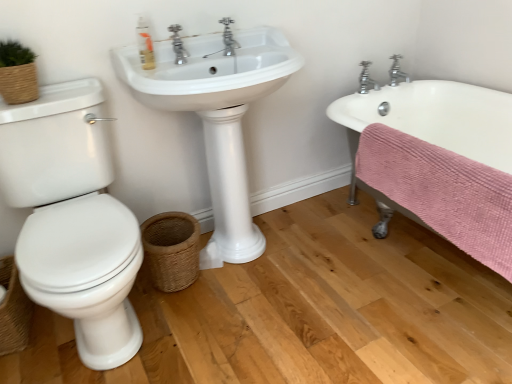
What do you see at coordinates (227, 39) in the screenshot? I see `chrome metallic faucet at upper center, acting as the first tap starting from the left` at bounding box center [227, 39].

What is the approximate width of woven brown basket at lower left, which is the 1th basket in left-to-right order?

13.03 inches.

At what (x,y) coordinates should I click in order to perform the action: click on silver metallic faucet at upper right, which is counted as the second tap, starting from the front. Please return your answer as a coordinate pair (x, y). This screenshot has height=384, width=512. Looking at the image, I should click on click(366, 79).

The image size is (512, 384). What do you see at coordinates (397, 71) in the screenshot? I see `chrome metallic faucet at upper right, which is counted as the 3th tap, starting from the left` at bounding box center [397, 71].

Image resolution: width=512 pixels, height=384 pixels. What do you see at coordinates (145, 45) in the screenshot?
I see `translucent plastic soap dispenser at upper center` at bounding box center [145, 45].

Locate an element on the screen. woven brown basket at lower center, acting as the 1th basket starting from the right is located at coordinates (172, 250).

Is silver metallic faucet at upper right, which ranks as the 2th tap in back-to-front order, facing away from translucent plastic soap dispenser at upper center?

That's not correct — silver metallic faucet at upper right, which ranks as the 2th tap in back-to-front order, is not looking away from translucent plastic soap dispenser at upper center.

From the picture: Is silver metallic faucet at upper right, which appears as the 2th tap when viewed from the right, to the left or to the right of translucent plastic soap dispenser at upper center in the image?

silver metallic faucet at upper right, which appears as the 2th tap when viewed from the right, is to the right of translucent plastic soap dispenser at upper center.

Would you say silver metallic faucet at upper right, which ranks as the 2th tap in back-to-front order, contains translucent plastic soap dispenser at upper center?

Actually, translucent plastic soap dispenser at upper center is outside silver metallic faucet at upper right, which ranks as the 2th tap in back-to-front order.

Looking at the image, does silver metallic faucet at upper right, which is counted as the second tap, starting from the front, seem bigger or smaller compared to translucent plastic soap dispenser at upper center?

Considering their sizes, silver metallic faucet at upper right, which is counted as the second tap, starting from the front, takes up more space than translucent plastic soap dispenser at upper center.

Can you confirm if silver metallic faucet at upper right, which ranks as the 2th tap in back-to-front order, is shorter than white glossy sink at center?

Yes.

Would you say silver metallic faucet at upper right, which appears as the 2th tap when viewed from the right, is outside white glossy sink at center?

Absolutely, silver metallic faucet at upper right, which appears as the 2th tap when viewed from the right, is external to white glossy sink at center.

From a real-world perspective, between silver metallic faucet at upper right, which ranks as the 2th tap in back-to-front order, and white glossy sink at center, who is vertically higher?

In real-world perspective, silver metallic faucet at upper right, which ranks as the 2th tap in back-to-front order, is above.

Does chrome metallic faucet at upper right, arranged as the first tap when viewed from the right, have a lesser height compared to silver metallic faucet at upper right, arranged as the second tap when viewed from the left?

In fact, chrome metallic faucet at upper right, arranged as the first tap when viewed from the right, may be taller than silver metallic faucet at upper right, arranged as the second tap when viewed from the left.

Does chrome metallic faucet at upper right, arranged as the first tap when viewed from the right, turn towards silver metallic faucet at upper right, arranged as the second tap when viewed from the left?

No, chrome metallic faucet at upper right, arranged as the first tap when viewed from the right, is not aimed at silver metallic faucet at upper right, arranged as the second tap when viewed from the left.

Which is in front, point (393, 74) or point (364, 66)?

Point (364, 66)

Which of these two, chrome metallic faucet at upper right, which appears as the 3th tap when viewed from the front, or woven brown basket at lower center, arranged as the 2th basket when viewed from the left, is thinner?

With smaller width is chrome metallic faucet at upper right, which appears as the 3th tap when viewed from the front.

Can you tell me how much chrome metallic faucet at upper right, arranged as the first tap when viewed from the right, and woven brown basket at lower center, acting as the 1th basket starting from the right, differ in facing direction?

The angular difference between chrome metallic faucet at upper right, arranged as the first tap when viewed from the right, and woven brown basket at lower center, acting as the 1th basket starting from the right, is 3.01 degrees.

Is chrome metallic faucet at upper right, arranged as the first tap when viewed from the right, oriented away from woven brown basket at lower center, arranged as the 2th basket when viewed from the left?

No, chrome metallic faucet at upper right, arranged as the first tap when viewed from the right, is not facing away from woven brown basket at lower center, arranged as the 2th basket when viewed from the left.

From a real-world perspective, between silver metallic faucet at upper right, arranged as the second tap when viewed from the left, and chrome metallic faucet at upper center, the 3th tap when ordered from right to left, who is vertically higher?

chrome metallic faucet at upper center, the 3th tap when ordered from right to left, is physically above.

Does silver metallic faucet at upper right, which is counted as the second tap, starting from the front, come in front of chrome metallic faucet at upper center, the 3th tap when ordered from right to left?

No, silver metallic faucet at upper right, which is counted as the second tap, starting from the front, is further to the viewer.

Is silver metallic faucet at upper right, arranged as the second tap when viewed from the left, far away from chrome metallic faucet at upper center, which is the first tap in front-to-back order?

That's not correct — silver metallic faucet at upper right, arranged as the second tap when viewed from the left, is a little close to chrome metallic faucet at upper center, which is the first tap in front-to-back order.

Looking at this image, is white glossy sink at center closer to the viewer compared to silver metallic faucet at upper right, which is counted as the second tap, starting from the front?

Yes, the depth of white glossy sink at center is less than that of silver metallic faucet at upper right, which is counted as the second tap, starting from the front.

Consider the image. Which is nearer, (230, 222) or (366, 81)?

Point (230, 222).

Would you say silver metallic faucet at upper right, which appears as the 2th tap when viewed from the right, is part of white glossy sink at center's contents?

Definitely not — silver metallic faucet at upper right, which appears as the 2th tap when viewed from the right, is not inside white glossy sink at center.

From the image's perspective, count 2nd baskets downward from the chrome metallic faucet at upper right, which is counted as the 3th tap, starting from the left, and point to it. Please provide its 2D coordinates.

[(13, 310)]

Can you confirm if chrome metallic faucet at upper right, the 1th tap positioned from the back, is thinner than woven brown basket at lower left, which is the 1th basket in left-to-right order?

Indeed, chrome metallic faucet at upper right, the 1th tap positioned from the back, has a lesser width compared to woven brown basket at lower left, which is the 1th basket in left-to-right order.

Is chrome metallic faucet at upper right, which appears as the 3th tap when viewed from the front, far away from woven brown basket at lower left, marked as the second basket in a right-to-left arrangement?

Yes, chrome metallic faucet at upper right, which appears as the 3th tap when viewed from the front, and woven brown basket at lower left, marked as the second basket in a right-to-left arrangement, are located far from each other.

Which of these two, chrome metallic faucet at upper right, the 1th tap positioned from the back, or woven brown basket at lower left, which is the 1th basket in left-to-right order, stands shorter?

chrome metallic faucet at upper right, the 1th tap positioned from the back, is shorter.

Identify the location of soap dispenser positioned vertically above the silver metallic faucet at upper right, which appears as the 2th tap when viewed from the right (from a real-world perspective). The image size is (512, 384). (145, 45).

Image resolution: width=512 pixels, height=384 pixels. Identify the location of the 2nd tap to the right of the white glossy sink at center, starting your count from the anchor. (x=366, y=79).

Which object lies further to the anchor point chrome metallic faucet at upper right, the 1th tap positioned from the back, woven brown basket at lower left, marked as the second basket in a right-to-left arrangement, or translucent plastic soap dispenser at upper center?

woven brown basket at lower left, marked as the second basket in a right-to-left arrangement, is positioned further to the anchor chrome metallic faucet at upper right, the 1th tap positioned from the back.

In the scene shown: Considering their positions, is translucent plastic soap dispenser at upper center positioned further to chrome metallic faucet at upper center, acting as the first tap starting from the left, than white glossy sink at center?

The object further to chrome metallic faucet at upper center, acting as the first tap starting from the left, is white glossy sink at center.

Considering their positions, is silver metallic faucet at upper right, which is counted as the second tap, starting from the front, positioned closer to white glossy sink at center than translucent plastic soap dispenser at upper center?

Among the two, translucent plastic soap dispenser at upper center is located nearer to white glossy sink at center.

Estimate the real-world distances between objects in this image. Which object is closer to white glossy sink at center, woven brown basket at lower left, which is the 1th basket in left-to-right order, or chrome metallic faucet at upper right, the 1th tap positioned from the back?

Based on the image, woven brown basket at lower left, which is the 1th basket in left-to-right order, appears to be nearer to white glossy sink at center.

When comparing their distances from chrome metallic faucet at upper right, arranged as the first tap when viewed from the right, does silver metallic faucet at upper right, which ranks as the 2th tap in back-to-front order, or white glossy sink at center seem further?

Based on the image, white glossy sink at center appears to be further to chrome metallic faucet at upper right, arranged as the first tap when viewed from the right.

Based on their spatial positions, is silver metallic faucet at upper right, which is counted as the second tap, starting from the front, or white glossy sink at center further from translucent plastic soap dispenser at upper center?

silver metallic faucet at upper right, which is counted as the second tap, starting from the front, lies further to translucent plastic soap dispenser at upper center than the other object.

When comparing their distances from woven brown basket at lower center, acting as the 1th basket starting from the right, does silver metallic faucet at upper right, which ranks as the 2th tap in back-to-front order, or chrome metallic faucet at upper center, the 3th tap when ordered from right to left, seem closer?

Among the two, chrome metallic faucet at upper center, the 3th tap when ordered from right to left, is located nearer to woven brown basket at lower center, acting as the 1th basket starting from the right.

Which object lies nearer to the anchor point woven brown basket at lower center, acting as the 1th basket starting from the right, woven brown basket at lower left, marked as the second basket in a right-to-left arrangement, or translucent plastic soap dispenser at upper center?

woven brown basket at lower left, marked as the second basket in a right-to-left arrangement.

You are a GUI agent. You are given a task and a screenshot of the screen. Output one action in this format:
    pyautogui.click(x=<x>, y=<y>)
    Task: Click on the sink located between translucent plastic soap dispenser at upper center and silver metallic faucet at upper right, which appears as the 2th tap when viewed from the right, in the left-right direction
    The width and height of the screenshot is (512, 384).
    Given the screenshot: What is the action you would take?
    pyautogui.click(x=217, y=118)

Where is `sink that lies between chrome metallic faucet at upper center, which is the third tap from back to front, and woven brown basket at lower center, acting as the 1th basket starting from the right, from top to bottom`? This screenshot has width=512, height=384. sink that lies between chrome metallic faucet at upper center, which is the third tap from back to front, and woven brown basket at lower center, acting as the 1th basket starting from the right, from top to bottom is located at coordinates (217, 118).

Where is `basket situated between woven brown basket at lower left, marked as the second basket in a right-to-left arrangement, and white glossy sink at center from left to right`? The width and height of the screenshot is (512, 384). basket situated between woven brown basket at lower left, marked as the second basket in a right-to-left arrangement, and white glossy sink at center from left to right is located at coordinates (172, 250).

Identify the location of basket between translucent plastic soap dispenser at upper center and woven brown basket at lower left, marked as the second basket in a right-to-left arrangement, in the vertical direction. The height and width of the screenshot is (384, 512). (172, 250).